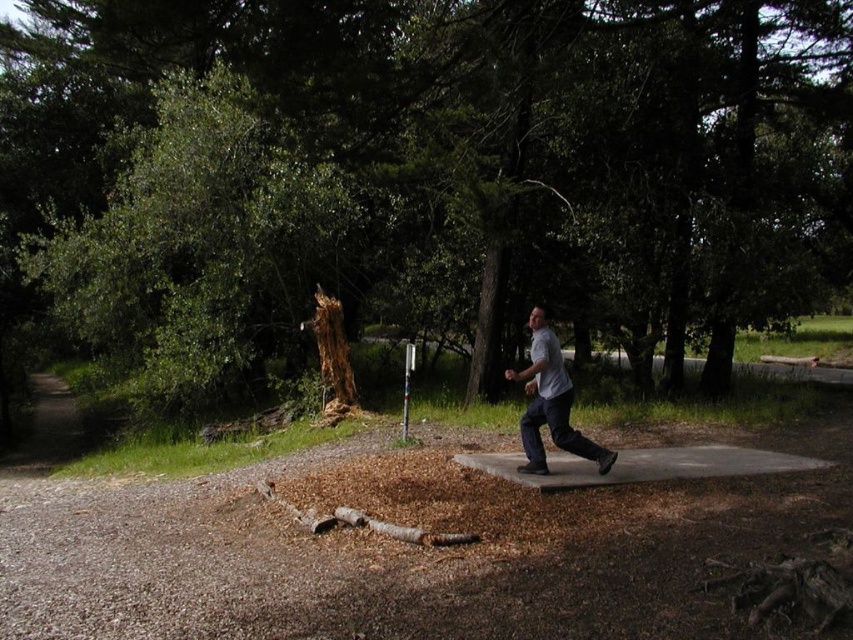
You are walking along a forest path and see a concrete slab at center and a white cotton shirt at center. Which object is closer to the ground?

The concrete slab at center is located below the white cotton shirt at center, so it is closer to the ground.

You are a hiker walking along the paved path in the park. You notice a brown rough tree at center and a white cotton shirt at center. Which object is taller?

The brown rough tree at center is much taller than the white cotton shirt at center.

You are a hiker walking along the path and notice the brown rough tree at center and the concrete slab at center. Which object is nearer to you?

The brown rough tree at center is closer to the viewer than the concrete slab at center, so it is nearer to you.